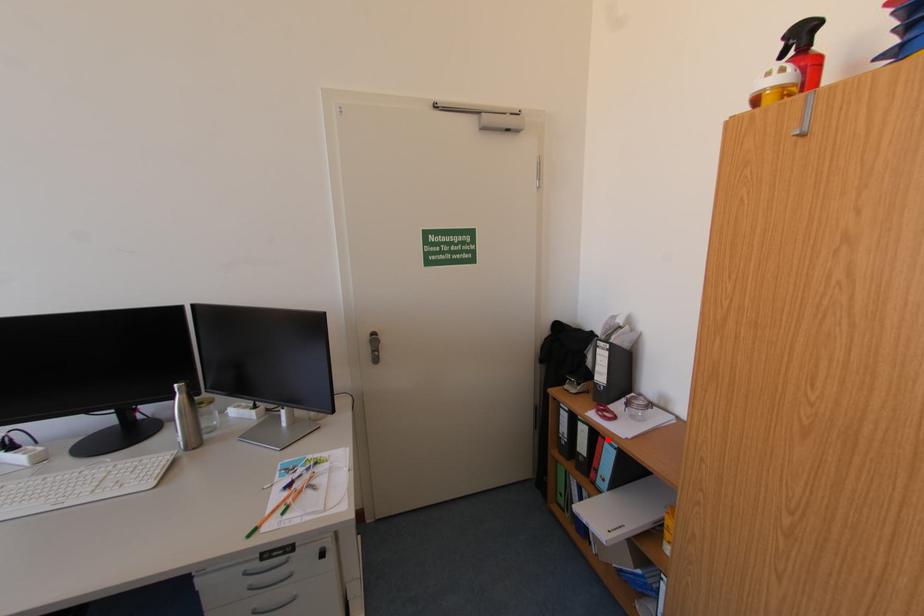
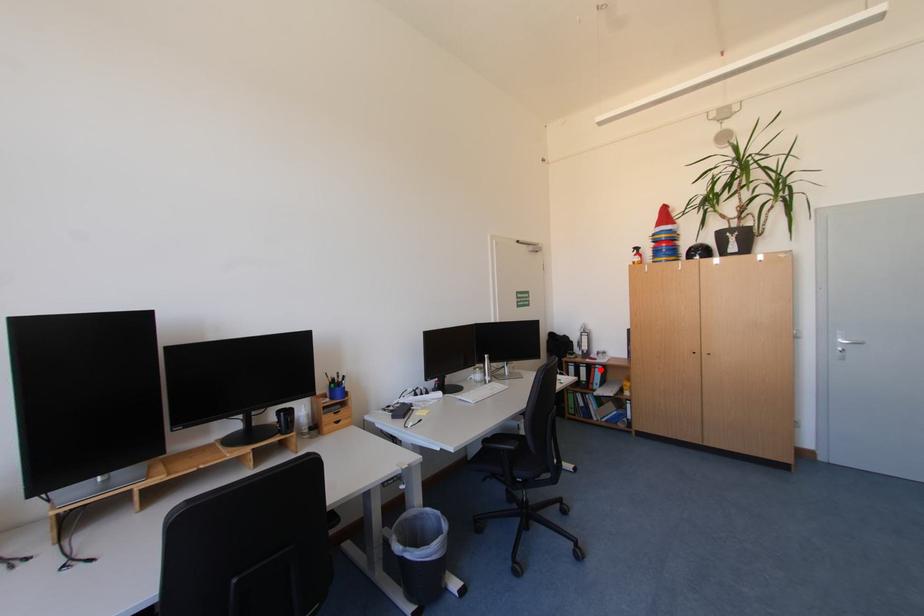
I am providing you with two images of the same scene from different viewpoints. A red point is marked on the first image and another point is marked on the second image. Are the points marked in image1 and image2 representing the same 3D position?

Yes